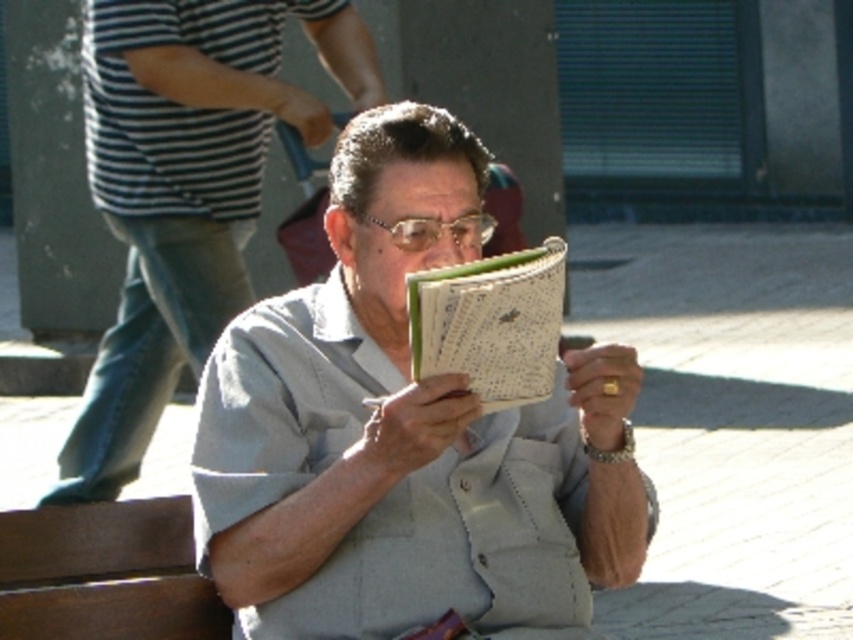
Question: Which of the following is the closest to the observer?

Choices:
 (A) (544, 298)
 (B) (595, 572)

Answer: (A)

Question: Is gray fabric shirt at center behind green textured notebook at center?

Choices:
 (A) no
 (B) yes

Answer: (B)

Question: In this image, where is gray fabric shirt at center located relative to green textured notebook at center?

Choices:
 (A) above
 (B) below

Answer: (A)

Question: Estimate the real-world distances between objects in this image. Which object is closer to the gray fabric shirt at center?

Choices:
 (A) light gray fabric shirt at center
 (B) green textured notebook at center

Answer: (A)

Question: Which point is closer to the camera?

Choices:
 (A) light gray fabric shirt at center
 (B) green textured notebook at center

Answer: (B)

Question: Can you confirm if light gray fabric shirt at center is bigger than green textured notebook at center?

Choices:
 (A) no
 (B) yes

Answer: (B)